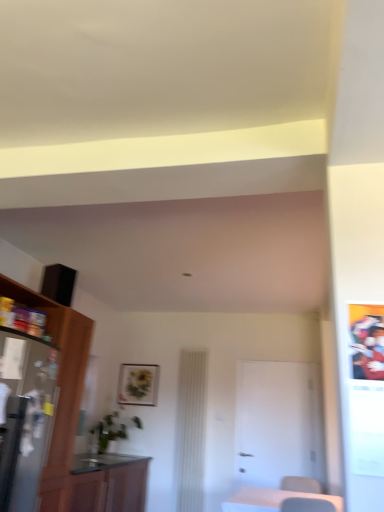
Question: Does point (86, 502) appear closer or farther from the camera than point (64, 503)?

Choices:
 (A) closer
 (B) farther

Answer: (B)

Question: Considering the positions of wooden cabinet at lower left, which is counted as the 2th cabinetry, starting from the top, and wooden cabinet at left, placed as the 2th cabinetry when sorted from bottom to top, in the image, is wooden cabinet at lower left, which is counted as the 2th cabinetry, starting from the top, taller or shorter than wooden cabinet at left, placed as the 2th cabinetry when sorted from bottom to top,?

Choices:
 (A) short
 (B) tall

Answer: (A)

Question: Considering the real-world distances, which object is farthest from the wooden table at lower right?

Choices:
 (A) metallic silver refrigerator at left
 (B) white matte door at center
 (C) wooden cabinet at left, marked as the 1th cabinetry in a top-to-bottom arrangement
 (D) wooden cabinet at lower left, which is counted as the 2th cabinetry, starting from the top
 (E) matte black picture frame at center

Answer: (E)

Question: Based on their relative distances, which object is nearer to the metallic silver refrigerator at left?

Choices:
 (A) matte black picture frame at center
 (B) wooden cabinet at left, marked as the 1th cabinetry in a top-to-bottom arrangement
 (C) wooden cabinet at lower left, positioned as the first cabinetry in bottom-to-top order
 (D) wooden table at lower right
 (E) white matte door at center

Answer: (B)